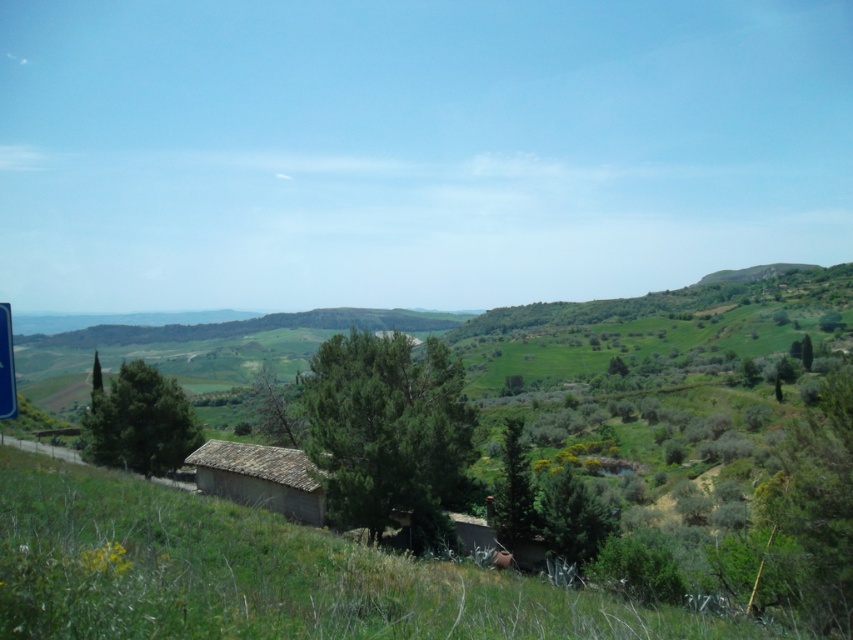
Who is higher up, brown stone hut at center or blue plastic sign at left?

blue plastic sign at left is higher up.

Does brown stone hut at center come in front of blue plastic sign at left?

That is False.

Does point (242, 464) come farther from viewer compared to point (6, 390)?

Yes.

Identify the location of brown stone hut at center. (260, 477).

You are a GUI agent. You are given a task and a screenshot of the screen. Output one action in this format:
    pyautogui.click(x=<x>, y=<y>)
    Task: Click on the green grassy at center
    
    Given the screenshot: What is the action you would take?
    pyautogui.click(x=265, y=573)

Identify the location of green grassy at center. This screenshot has height=640, width=853. (265, 573).

In the scene shown: Who is more distant from viewer, (x=192, y=576) or (x=3, y=410)?

The point (x=192, y=576) is more distant.

Is green grassy at center thinner than blue plastic sign at left?

Incorrect, green grassy at center's width is not less than blue plastic sign at left's.

Where is `green grassy at center`? The height and width of the screenshot is (640, 853). green grassy at center is located at coordinates (265, 573).

Where is `green grassy at center`? green grassy at center is located at coordinates click(265, 573).